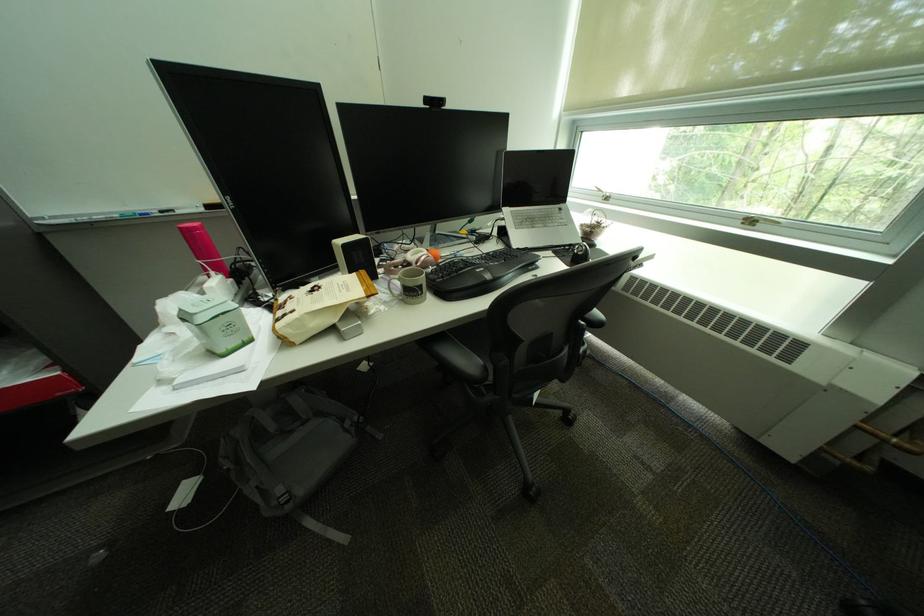
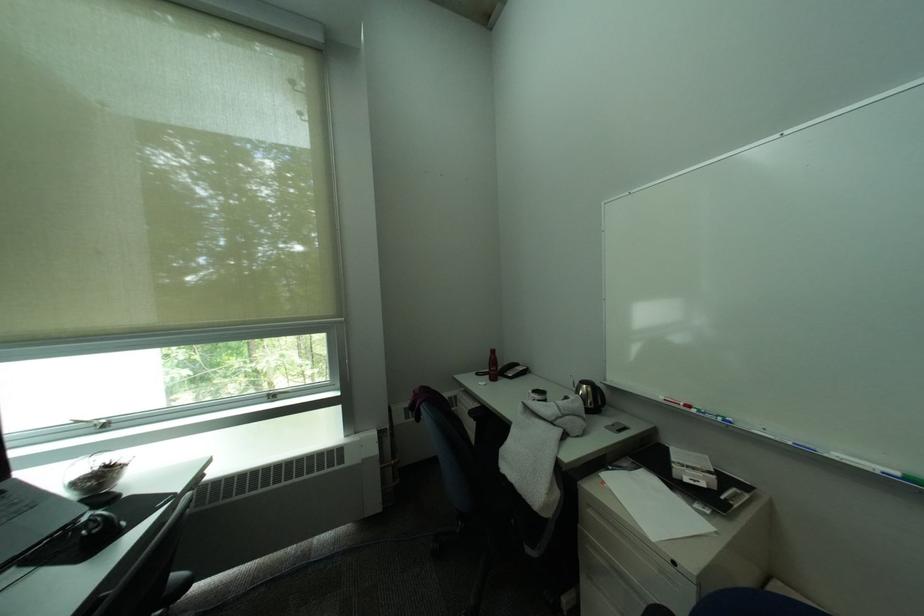
The point at (614, 198) is marked in the first image. Where is the corresponding point in the second image?

(106, 427)